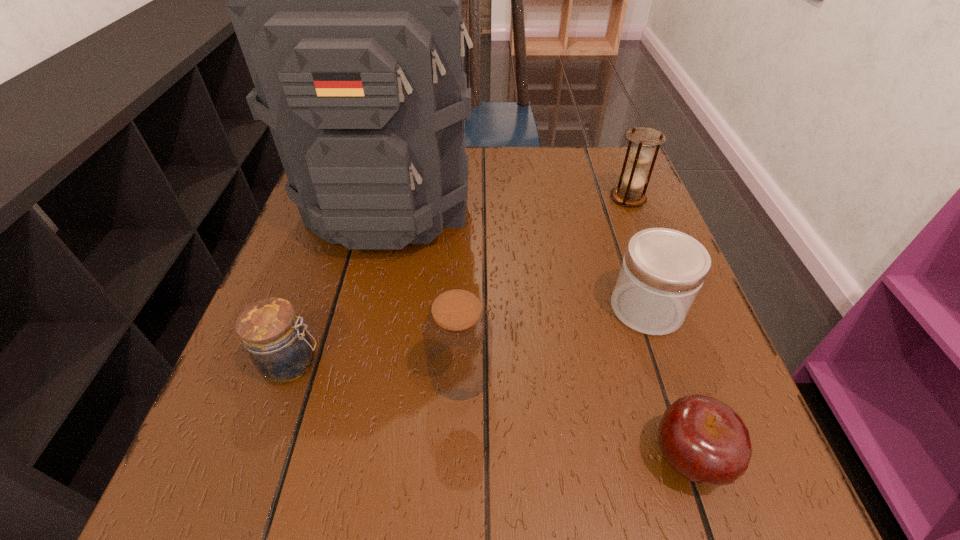
Where is `vacant space in between the third farthest object and the backpack`? vacant space in between the third farthest object and the backpack is located at coordinates (519, 255).

Where is `free space between the second jar from right to left and the third farthest object`? free space between the second jar from right to left and the third farthest object is located at coordinates (554, 340).

This screenshot has width=960, height=540. Identify the location of object that is the third closest one to the backpack. point(663,270).

This screenshot has height=540, width=960. What are the coordinates of `object identified as the fifth closest to the second jar from right to left` in the screenshot? It's located at (640, 155).

Where is `jar that is the second closest one to the tallest object`? This screenshot has width=960, height=540. jar that is the second closest one to the tallest object is located at coordinates (458, 333).

Locate which jar ranks second in proximity to the second jar from left to right. Please provide its 2D coordinates. Your answer should be formatted as a tuple, i.e. [(x, y)], where the tuple contains the x and y coordinates of a point satisfying the conditions above.

[(663, 270)]

At what (x,y) coordinates should I click in order to perform the action: click on free space that satisfies the following two spatial constraints: 1. on the front compartment of the second jar from left to right; 2. on the right side of the tallest object. Please return your answer as a coordinate pair (x, y). Looking at the image, I should click on pos(353,372).

At what (x,y) coordinates should I click in order to perform the action: click on vacant space that satisfies the following two spatial constraints: 1. on the front compartment of the backpack; 2. on the lid of the leftmost jar. Please return your answer as a coordinate pair (x, y). Looking at the image, I should click on (355, 363).

Where is `free space in the image that satisfies the following two spatial constraints: 1. on the back side of the second jar from right to left; 2. on the lid of the leftmost jar`? free space in the image that satisfies the following two spatial constraints: 1. on the back side of the second jar from right to left; 2. on the lid of the leftmost jar is located at coordinates (461, 363).

Where is `free point that satisfies the following two spatial constraints: 1. on the front compartment of the second jar from left to right; 2. on the left side of the backpack`? This screenshot has height=540, width=960. free point that satisfies the following two spatial constraints: 1. on the front compartment of the second jar from left to right; 2. on the left side of the backpack is located at coordinates (353, 372).